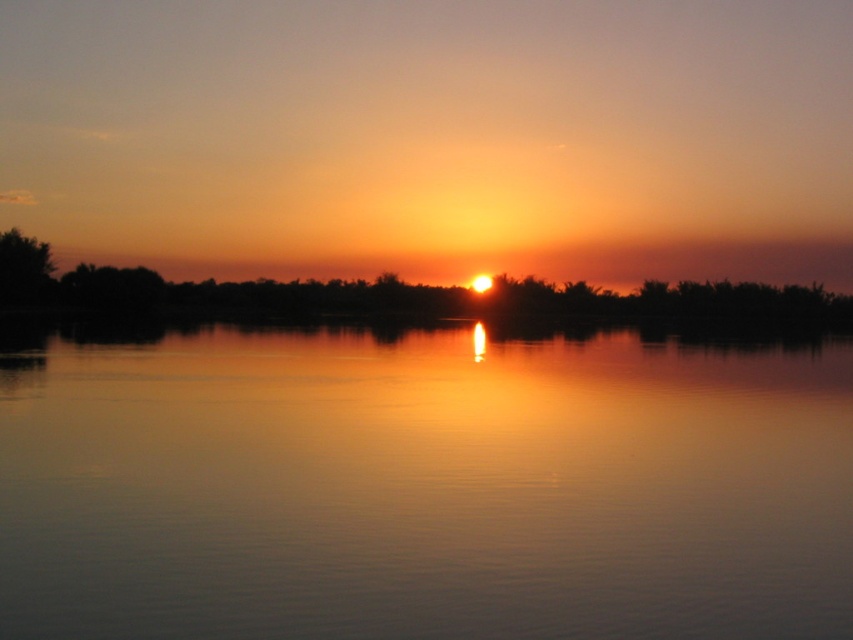
You are an artist planning to paint the sunset scene. You have a canvas that can only accommodate the width of the green leafy tree at left. Can you fit the glossy water at center on your canvas?

The glossy water at center has a larger width than the green leafy tree at left. Since your canvas can only accommodate the width of the green leafy tree at left, the glossy water at center will not fit on the canvas.

You are an artist trying to paint the sunset scene. You have to decide which area to focus on first based on their sizes. Which object should you paint first, the glossy water at center or the green leafy tree at left?

The glossy water at center is larger in size than the green leafy tree at left, so you should paint the glossy water at center first as it occupies more space in the scene.

You are standing on a dock and see the glossy water at center and the green leafy tree at left. Which object is closer to you?

The glossy water at center is closer to you because it is located below the green leafy tree at left, indicating it is in a lower position relative to the tree.